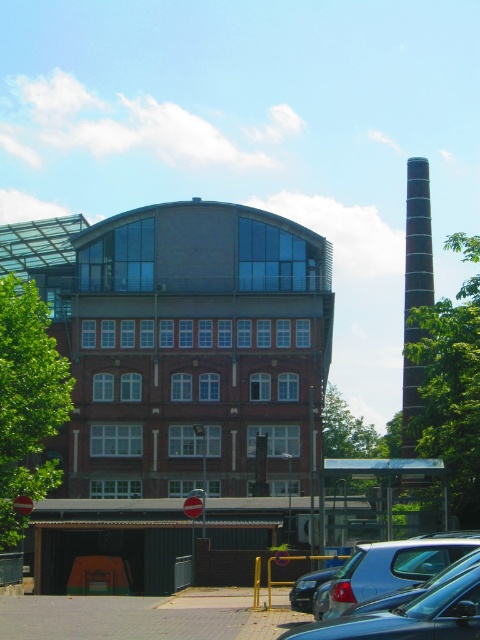
Question: Which object appears closest to the camera in this image?

Choices:
 (A) shiny silver sedan at center
 (B) brown brick building at center

Answer: (A)

Question: Which object is the closest to the green leafy tree at right?

Choices:
 (A) black textured chimney at right
 (B) brown brick building at center
 (C) green leafy tree at left

Answer: (B)

Question: Is brown brick building at center to the left of green leafy tree at left from the viewer's perspective?

Choices:
 (A) yes
 (B) no

Answer: (B)

Question: Which point is farther to the camera?

Choices:
 (A) metallic silver car at center
 (B) green leafy tree at right
 (C) green leafy tree at left

Answer: (C)

Question: Can you confirm if brown brick building at center is positioned below green leafy tree at right?

Choices:
 (A) yes
 (B) no

Answer: (A)

Question: Is green leafy tree at left bigger than metallic silver car at center?

Choices:
 (A) no
 (B) yes

Answer: (B)